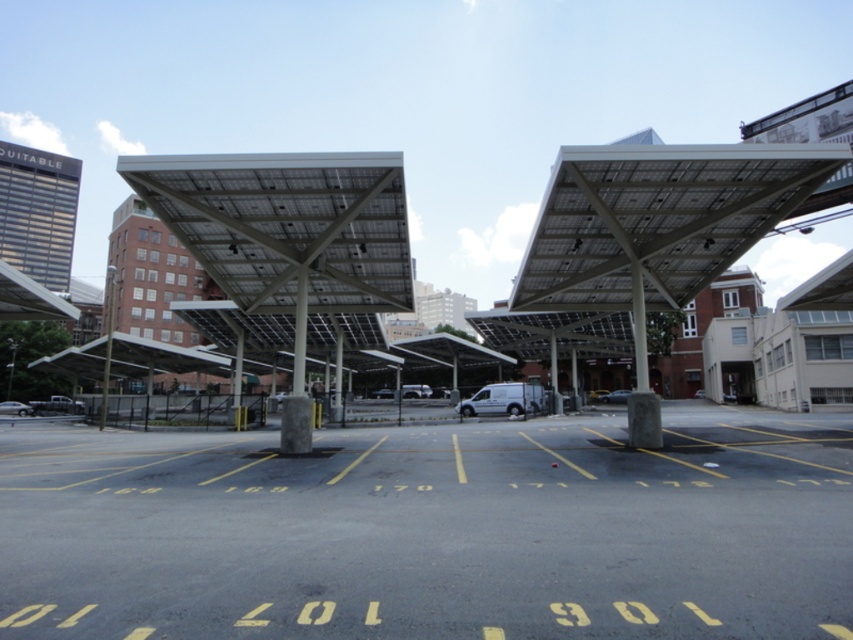
Question: Which point is farther from the camera taking this photo?

Choices:
 (A) (619, 397)
 (B) (309, 532)
 (C) (16, 406)

Answer: (A)

Question: Does black asphalt parking lot at center lie behind silver metallic car at lower left?

Choices:
 (A) yes
 (B) no

Answer: (B)

Question: Based on their relative distances, which object is farther from the black asphalt parking lot at center?

Choices:
 (A) metallic silver sedan at center
 (B) silver metallic car at lower left

Answer: (B)

Question: Which of the following is the farthest from the observer?

Choices:
 (A) (611, 394)
 (B) (311, 483)
 (C) (22, 410)

Answer: (A)

Question: Does black asphalt parking lot at center have a greater width compared to silver metallic car at lower left?

Choices:
 (A) yes
 (B) no

Answer: (A)

Question: Considering the relative positions of black asphalt parking lot at center and metallic silver sedan at center in the image provided, where is black asphalt parking lot at center located with respect to metallic silver sedan at center?

Choices:
 (A) above
 (B) below

Answer: (A)